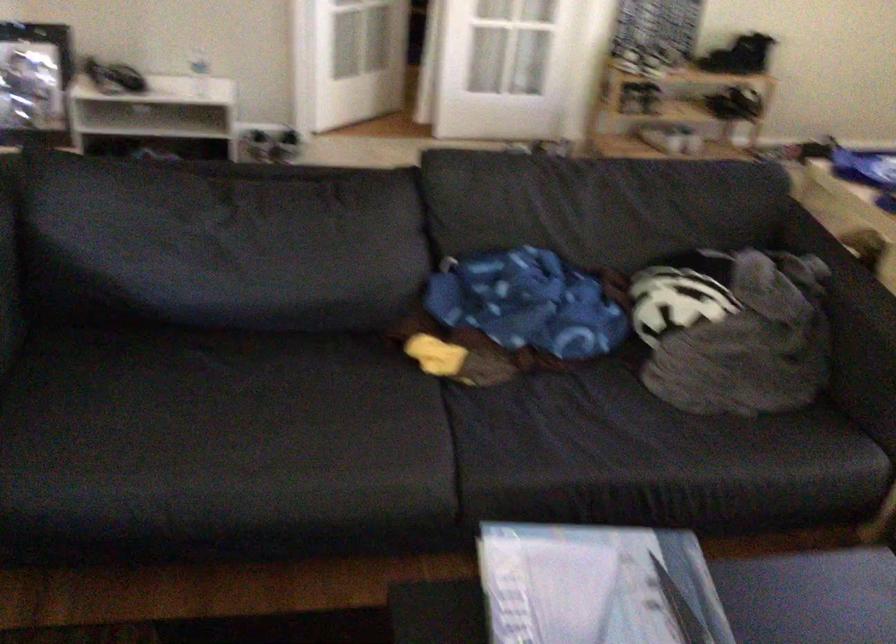
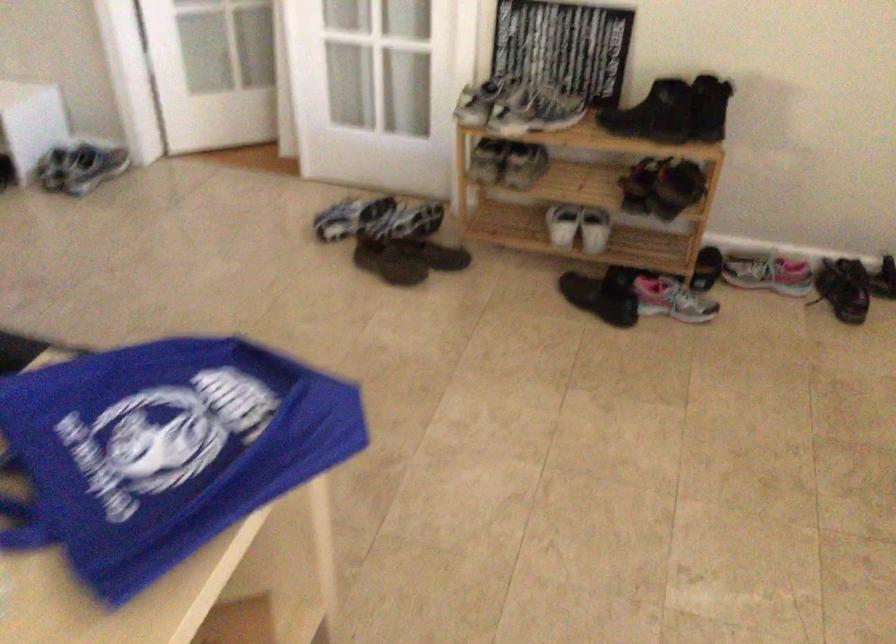
Which direction would the cameraman need to move to produce the second image?

The cameraman moved toward right, forward.